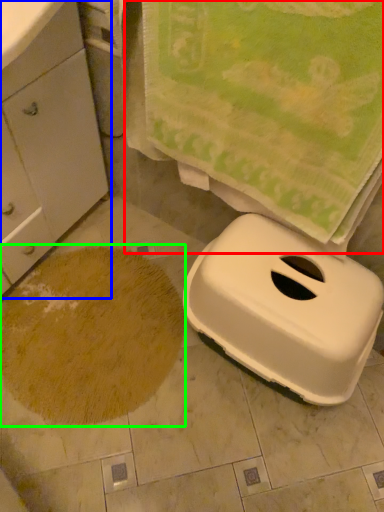
Question: Considering the real-world distances, which object is closest to beach towel (highlighted by a red box)? cabinetry (highlighted by a blue box) or sand (highlighted by a green box).

Choices:
 (A) cabinetry
 (B) sand

Answer: (A)